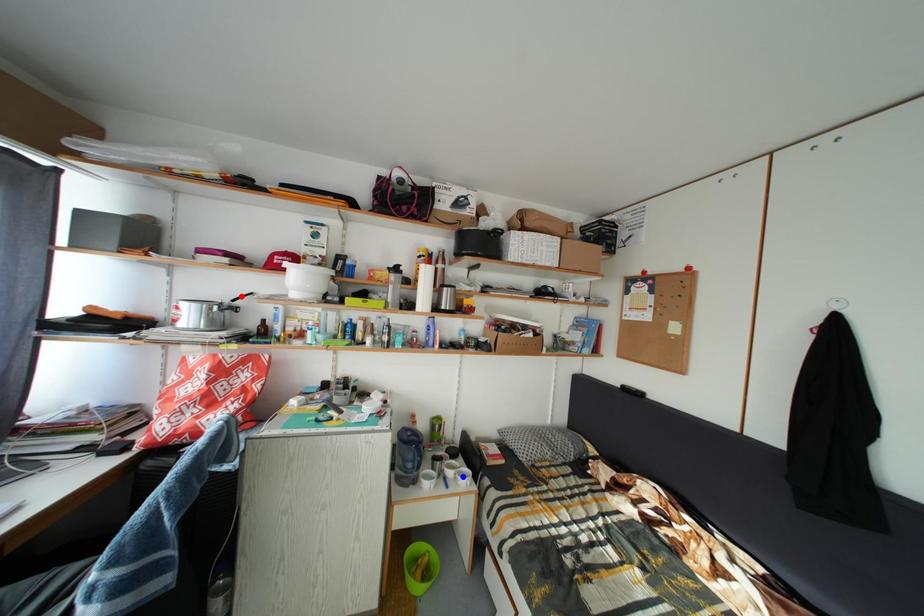
Question: Which of the two points in the image is closer to the camera?

Choices:
 (A) Blue point is closer.
 (B) Red point is closer.

Answer: (B)